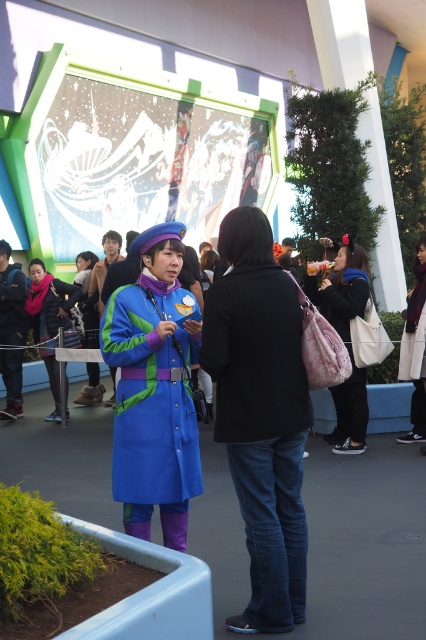
You are a photographer at the event and need to position a light to the left of both the white cotton dress at center and the blue fabric coat at center. Is this possible given their positions?

The white cotton dress at center is to the right of the blue fabric coat at center. Therefore, positioning a light to the left of both would be possible as long as the light is placed to the left of the blue fabric coat at center, which is the leftmost object between the two.

You are a photographer at the event and want to capture a photo of both the black matte jacket at center and the blue fabric coat at center clearly. Since the camera can only focus on one subject at a time, which one should you focus on to ensure the other is still in the background?

You should focus on the black matte jacket at center because it is in front of the blue fabric coat at center, so if you focus on the front object, the background object will still be visible but slightly out of focus.

You are a photographer standing at the event. You want to take a photo of the matte blue coat at center from a distance that ensures it fills the frame without being too close. Given that your camera has a maximum zoom range of 100 meters, is the current distance sufficient?

The matte blue coat at center is 3.60 meters away from the camera. Since the camera can zoom up to 100 meters, the distance of 3.60 meters is well within the zoom range, so the photographer can adjust the zoom to capture the matte blue coat at center clearly without being too close.